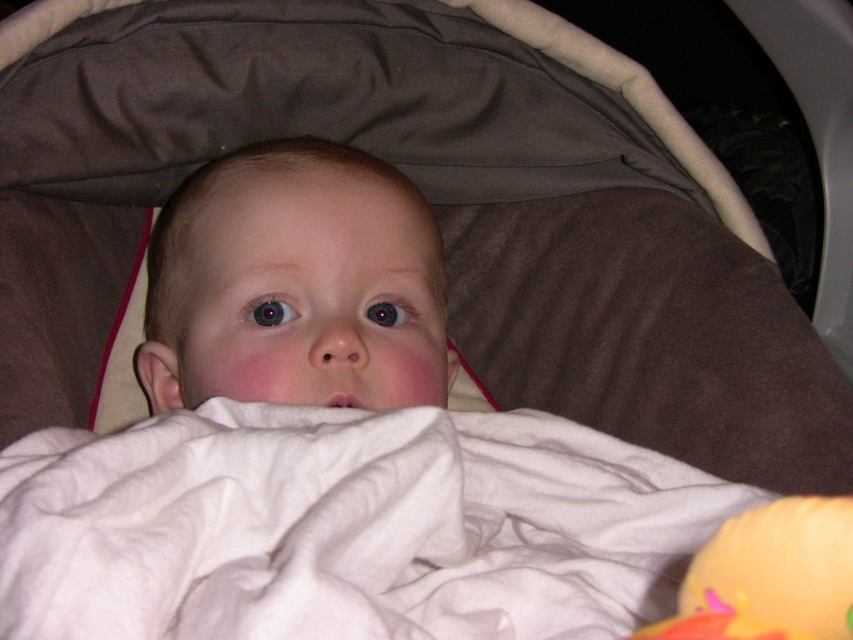
Question: Where is white soft blanket at center located in relation to orange rubber duck at lower right in the image?

Choices:
 (A) right
 (B) left

Answer: (B)

Question: Which of the following is the closest to the observer?

Choices:
 (A) orange rubber duck at lower right
 (B) white soft blanket at center

Answer: (B)

Question: Considering the relative positions of white soft blanket at center and orange rubber duck at lower right in the image provided, where is white soft blanket at center located with respect to orange rubber duck at lower right?

Choices:
 (A) right
 (B) left

Answer: (B)

Question: Which object is closer to the camera taking this photo?

Choices:
 (A) orange rubber duck at lower right
 (B) white soft blanket at center

Answer: (B)

Question: Which point is farther to the camera?

Choices:
 (A) orange rubber duck at lower right
 (B) white soft blanket at center

Answer: (A)

Question: Is white soft blanket at center smaller than orange rubber duck at lower right?

Choices:
 (A) yes
 (B) no

Answer: (B)